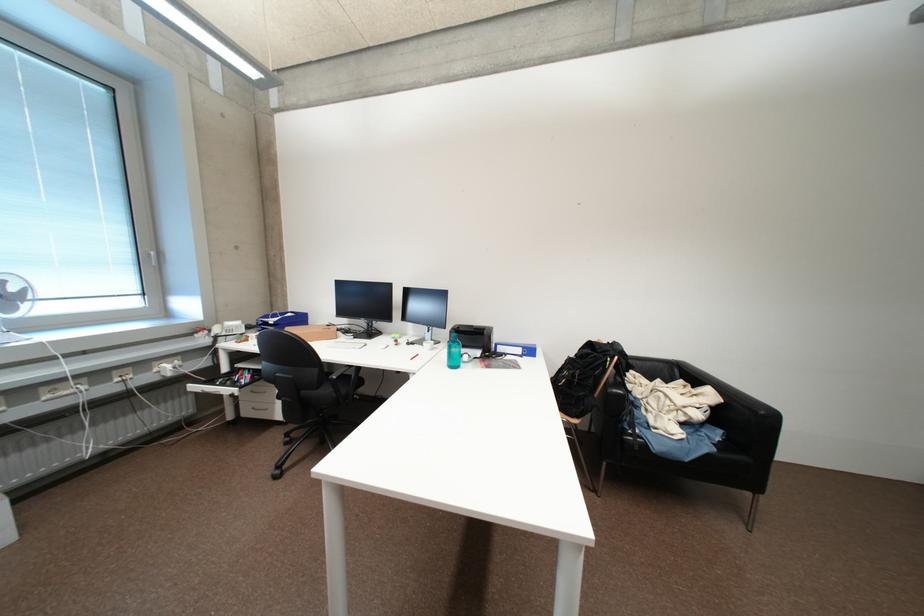
Where is `telephone handset`? telephone handset is located at coordinates (227, 328).